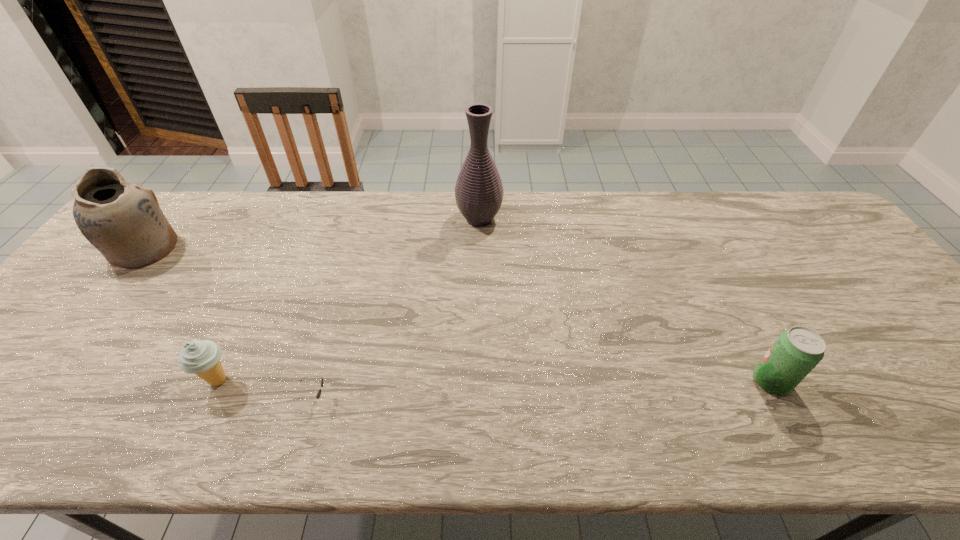
Where is `vase`? vase is located at coordinates (479, 192).

Locate an element on the screen. Image resolution: width=960 pixels, height=540 pixels. the tallest object is located at coordinates (479, 192).

At what (x,y) coordinates should I click in order to perform the action: click on pottery. Please return your answer as a coordinate pair (x, y). This screenshot has height=540, width=960. Looking at the image, I should click on (122, 220).

Identify the location of the fourth shortest object. (122, 220).

Where is `the rightmost object`? the rightmost object is located at coordinates (797, 351).

The width and height of the screenshot is (960, 540). In order to click on the second object from left to right in this screenshot , I will do `click(202, 358)`.

The image size is (960, 540). I want to click on sunglasses, so click(318, 395).

At what (x,y) coordinates should I click in order to perform the action: click on the shortest object. Please return your answer as a coordinate pair (x, y). Looking at the image, I should click on (318, 395).

Locate an element on the screen. vacant space situated 0.160m on the right of the tallest object is located at coordinates (554, 219).

You are a GUI agent. You are given a task and a screenshot of the screen. Output one action in this format:
    pyautogui.click(x=<x>, y=<y>)
    Task: Click on the free space located 0.230m on the right of the leftmost object
    
    Given the screenshot: What is the action you would take?
    pyautogui.click(x=253, y=249)